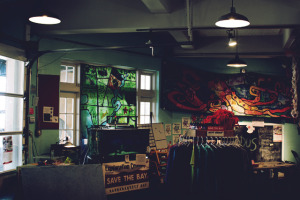
Locate an element on the screen. counter is located at coordinates (70, 180).